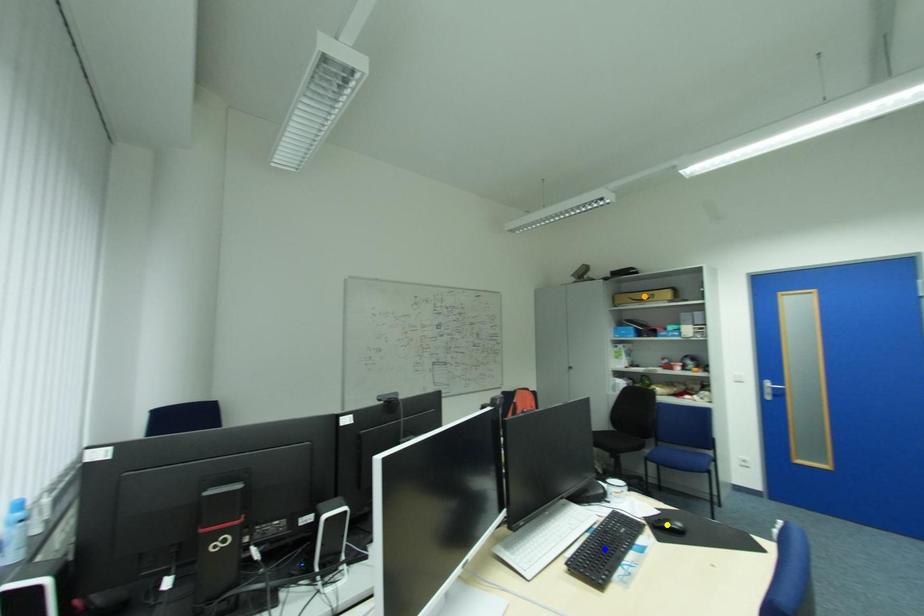
Order these from nearest to farthest:
yellow point | orange point | blue point

orange point, yellow point, blue point